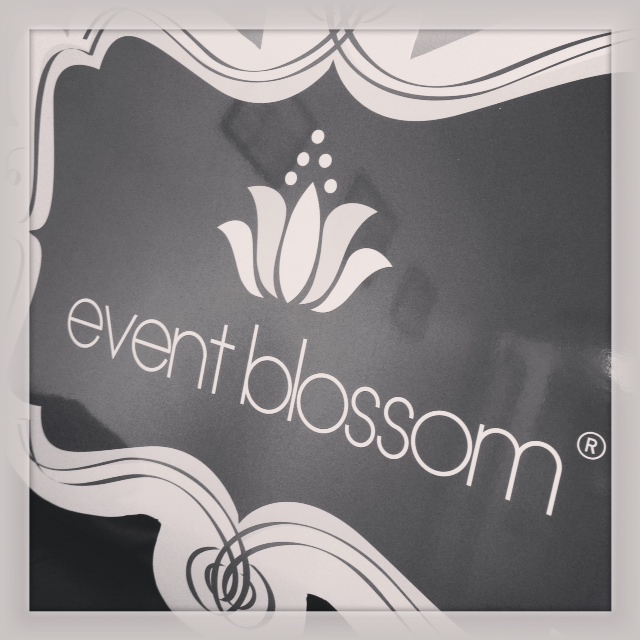
Find the location of `curtain like design`. curtain like design is located at coordinates (274, 68), (442, 86), (212, 532), (259, 527).